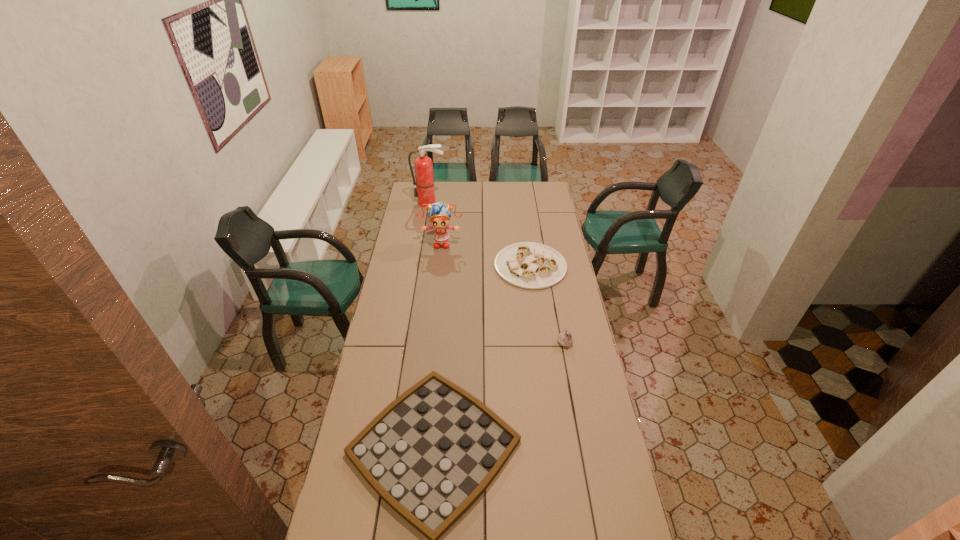
Locate an element on the screen. This screenshot has height=540, width=960. the farthest object is located at coordinates (423, 165).

Locate an element on the screen. The width and height of the screenshot is (960, 540). fire extinguisher is located at coordinates (423, 165).

Locate an element on the screen. doll is located at coordinates (439, 214).

What are the coordinates of `the third tallest object` in the screenshot? It's located at (564, 338).

Locate an element on the screen. the second nearest object is located at coordinates (564, 338).

Locate an element on the screen. The width and height of the screenshot is (960, 540). platter is located at coordinates (529, 265).

Identify the location of vacant region located 0.250m with the handle and hose on the fire extinguisher. (425, 231).

At what (x,y) coordinates should I click in order to perform the action: click on free space located on the face of the second tallest object. Please return your answer as a coordinate pair (x, y). The image size is (960, 540). Looking at the image, I should click on (436, 292).

Where is `blank space located on the back of the third tallest object`? This screenshot has width=960, height=540. blank space located on the back of the third tallest object is located at coordinates (561, 321).

Identify the location of free space located on the left of the platter. (453, 266).